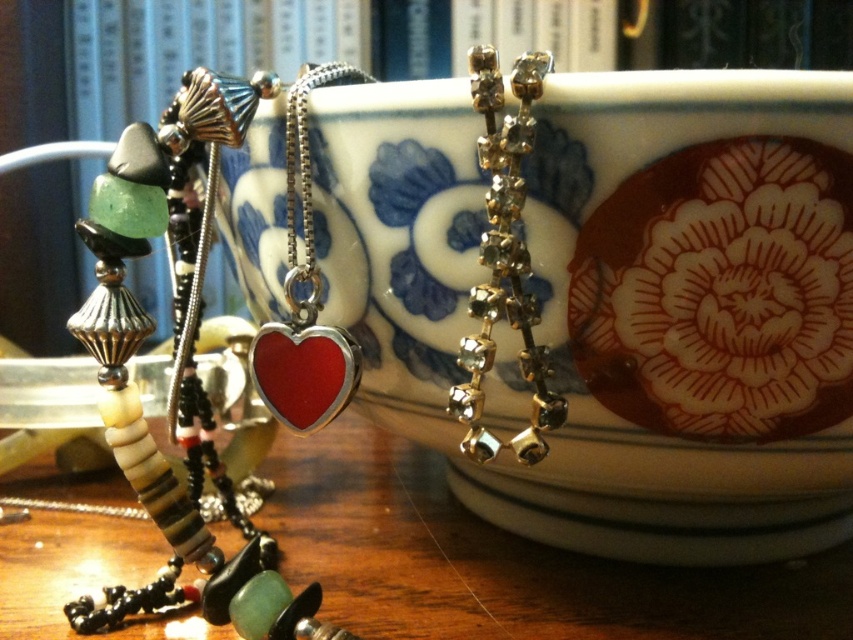
Measure the distance between shiny red heart pendant at center and shiny silver heart at center.

A distance of 2.81 inches exists between shiny red heart pendant at center and shiny silver heart at center.

Who is shorter, shiny red heart pendant at center or shiny silver heart at center?

Standing shorter between the two is shiny silver heart at center.

Does point (123, 445) lie in front of point (299, 148)?

Yes, it is.

What are the coordinates of `shiny red heart pendant at center` in the screenshot? It's located at (173, 353).

Does clear crystal earrings at upper center have a larger size compared to shiny red heart at center?

Yes.

Is point (527, 266) positioned before point (318, 410)?

Yes, point (527, 266) is closer to viewer.

Identify the location of clear crystal earrings at upper center. (503, 260).

Does clear crystal earrings at upper center have a greater width compared to shiny silver heart at center?

No.

How much distance is there between clear crystal earrings at upper center and shiny silver heart at center?

They are 4.26 inches apart.

The height and width of the screenshot is (640, 853). I want to click on clear crystal earrings at upper center, so tap(503, 260).